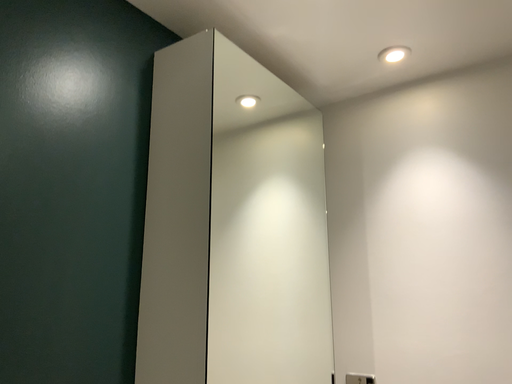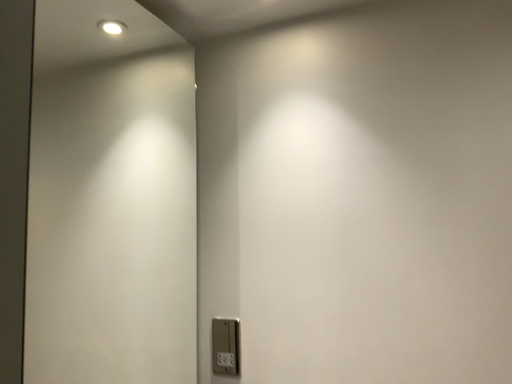
Question: Which way did the camera rotate in the video?

Choices:
 (A) rotated left
 (B) rotated right

Answer: (B)